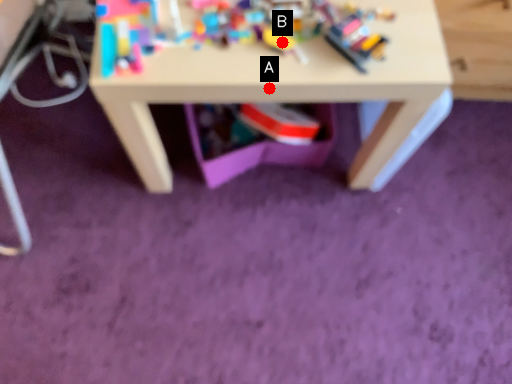
Question: Two points are circled on the image, labeled by A and B beside each circle. Which point is closer to the camera?

Choices:
 (A) A is closer
 (B) B is closer

Answer: (A)